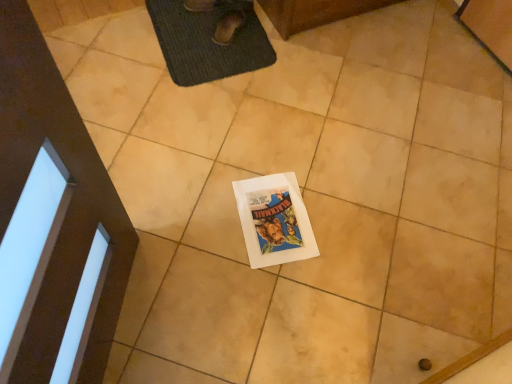
In order to click on free point to the left of white paper comic book at center in this screenshot , I will do `click(198, 211)`.